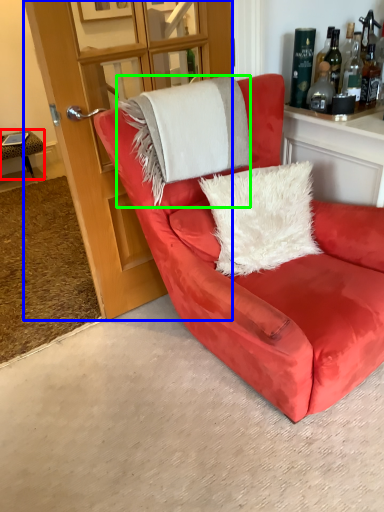
Question: Considering the real-world distances, which object is farthest from table (highlighted by a red box)? glass door (highlighted by a blue box) or blanket (highlighted by a green box)?

Choices:
 (A) glass door
 (B) blanket

Answer: (B)